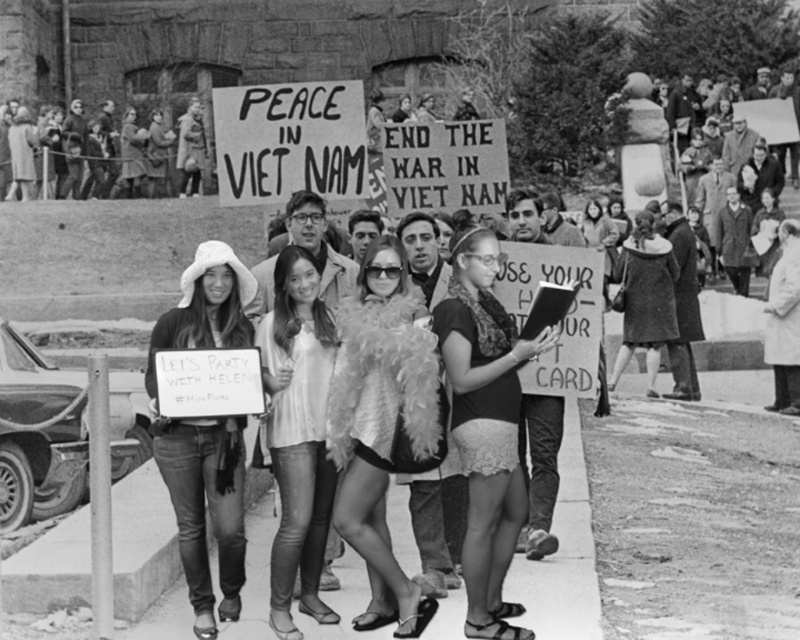
Question: Does black lace shorts at center have a lesser width compared to matte black coat at center?

Choices:
 (A) yes
 (B) no

Answer: (B)

Question: Is denim jeans at center above matte black coat at center?

Choices:
 (A) no
 (B) yes

Answer: (A)

Question: Based on their relative distances, which object is nearer to the denim jeans at center?

Choices:
 (A) matte black coat at center
 (B) light beige blouse at center
 (C) feathered white capelet at center

Answer: (B)

Question: Which is farther from the white fur coat at center?

Choices:
 (A) black lace shorts at center
 (B) denim jeans at center
 (C) light beige blouse at center
 (D) matte black coat at center

Answer: (C)

Question: Based on their relative distances, which object is nearer to the light beige blouse at center?

Choices:
 (A) matte black coat at center
 (B) feathered white capelet at center
 (C) denim jeans at center

Answer: (B)

Question: Is black lace shorts at center smaller than white fur coat at center?

Choices:
 (A) yes
 (B) no

Answer: (B)